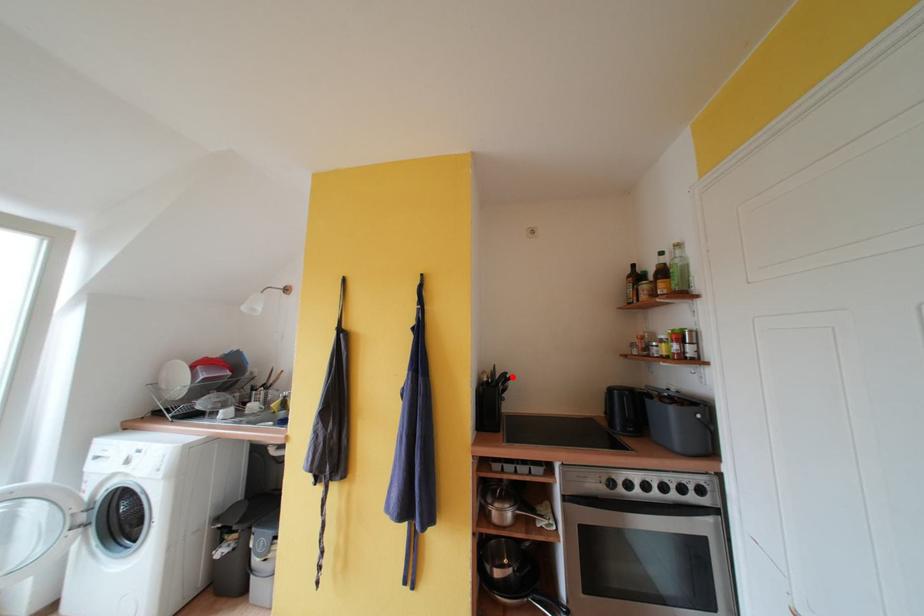
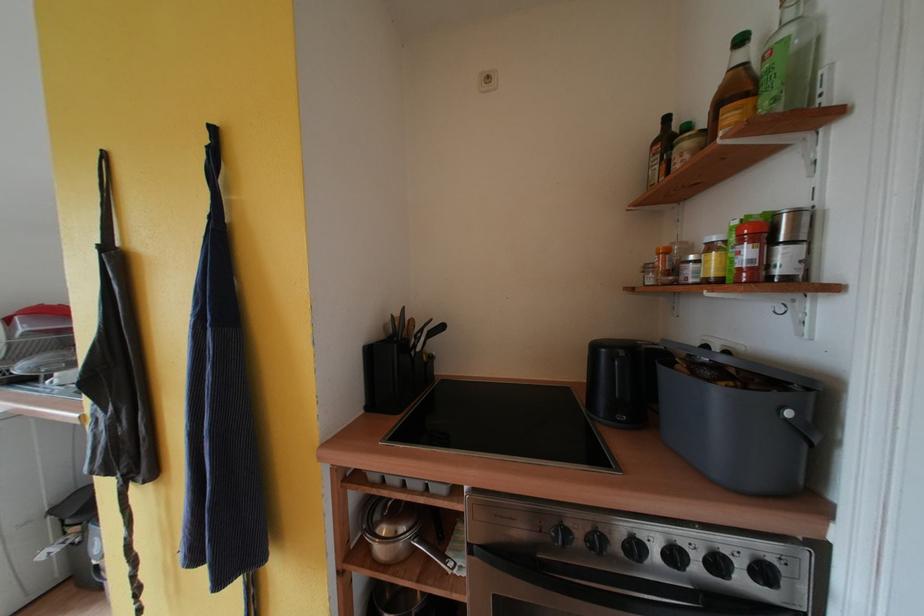
Locate, in the second image, the point that corresponds to the highlighted location in the first image.

(436, 323)